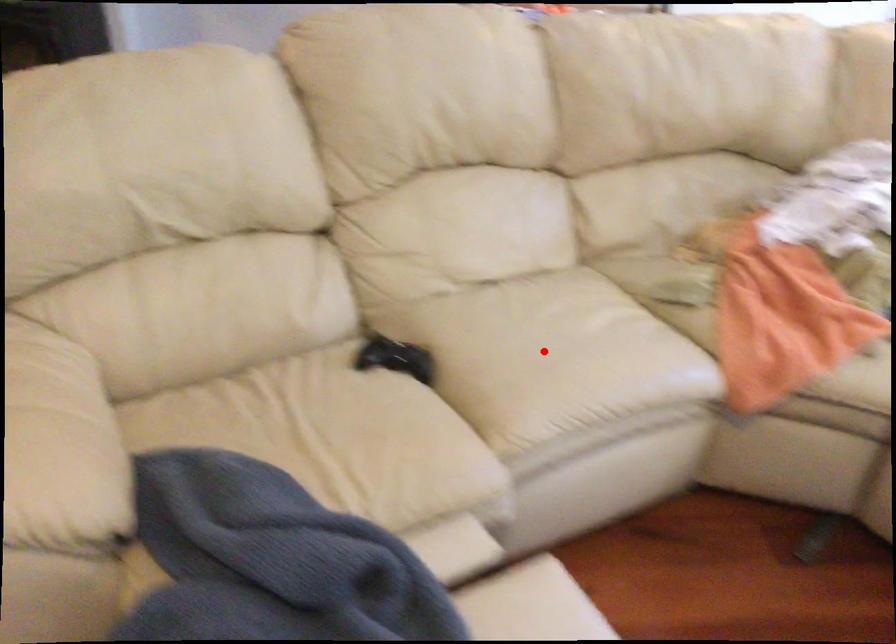
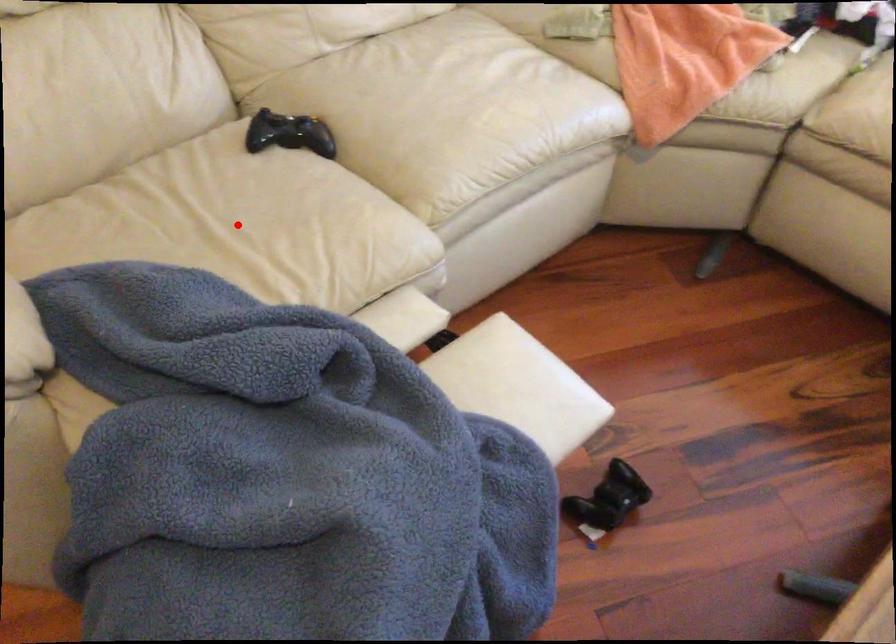
I am providing you with two images of the same scene from different viewpoints. A red point is marked on the first image and another point is marked on the second image. Does the point marked in image1 correspond to the same location as the one in image2?

No